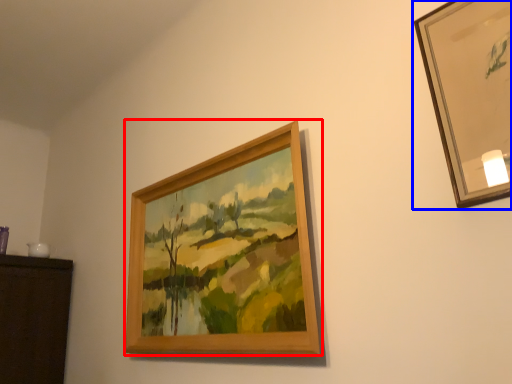
Question: Which object appears closest to the camera in this image, picture frame (highlighted by a red box) or picture frame (highlighted by a blue box)?

Choices:
 (A) picture frame
 (B) picture frame

Answer: (B)